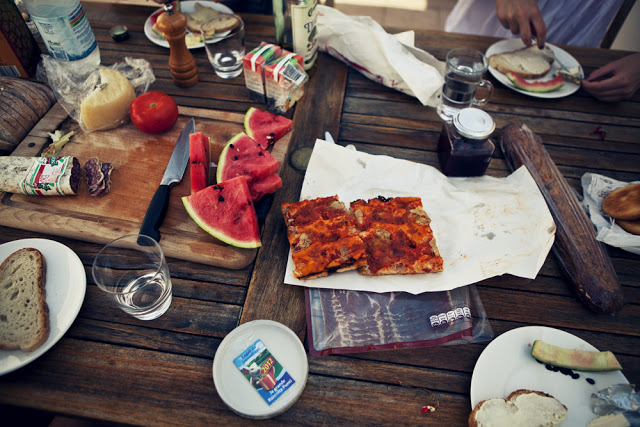
Image resolution: width=640 pixels, height=427 pixels. In order to click on wood table in this screenshot , I will do `click(194, 364)`, `click(352, 391)`.